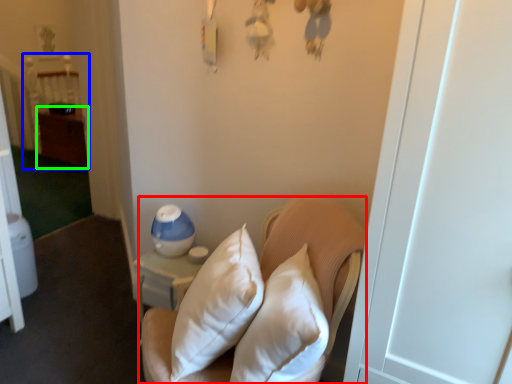
Question: Estimate the real-world distances between objects in this image. Which object is closer to furniture (highlighted by a red box), bed (highlighted by a blue box) or dresser (highlighted by a green box)?

Choices:
 (A) bed
 (B) dresser

Answer: (B)